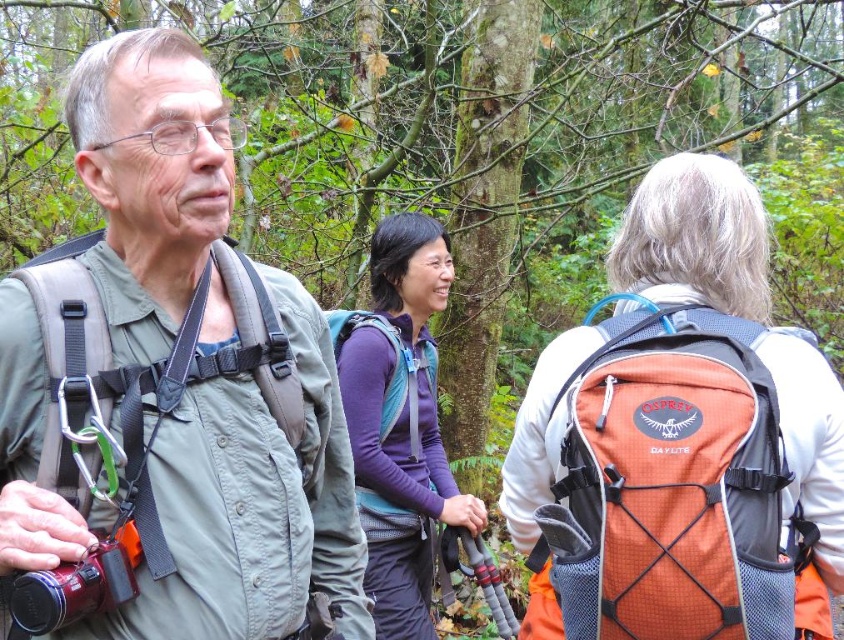
Can you confirm if purple fleece jacket at center is positioned to the right of teal mesh backpack at center?

In fact, purple fleece jacket at center is to the left of teal mesh backpack at center.

Between point (366, 422) and point (383, 438), which one is positioned in front?

Point (366, 422) is more forward.

I want to click on purple fleece jacket at center, so click(x=399, y=420).

Identify the location of purple fleece jacket at center. (399, 420).

Who is higher up, orange mesh backpack at upper right or purple fleece jacket at center?

Positioned higher is orange mesh backpack at upper right.

Can you confirm if orange mesh backpack at upper right is positioned to the left of purple fleece jacket at center?

No, orange mesh backpack at upper right is not to the left of purple fleece jacket at center.

Who is more forward, (657, 512) or (391, 528)?

Point (657, 512) is more forward.

Where is `orange mesh backpack at upper right`? orange mesh backpack at upper right is located at coordinates (672, 484).

Measure the distance between orange mesh backpack at upper right and camera.

orange mesh backpack at upper right and camera are 5.38 feet apart.

Which is in front, point (614, 524) or point (383, 428)?

Point (614, 524)

Does point (675, 376) lie behind point (426, 348)?

No, it is not.

This screenshot has width=844, height=640. I want to click on orange mesh backpack at upper right, so click(x=672, y=484).